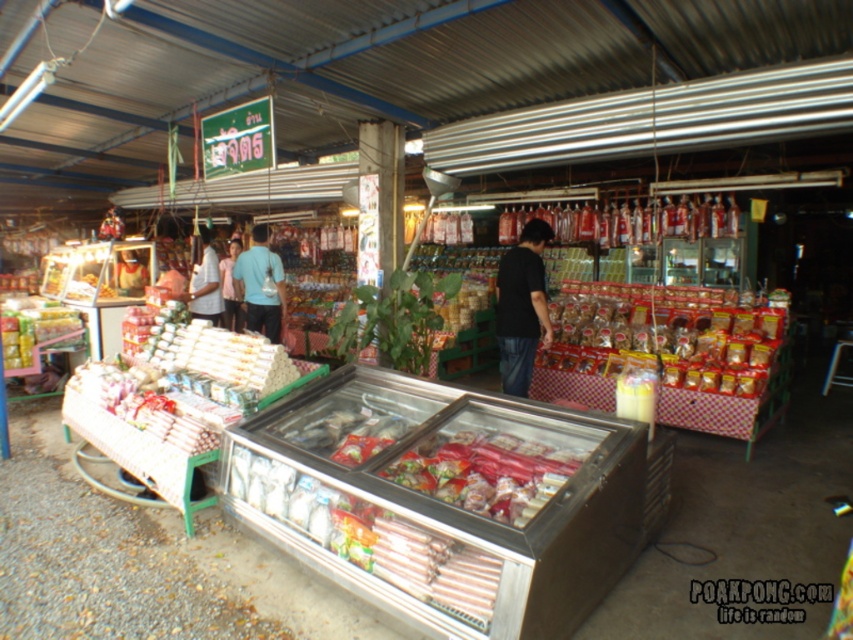
Question: Among these points, which one is farthest from the camera?

Choices:
 (A) (206, 291)
 (B) (541, 291)
 (C) (170, 381)
 (D) (241, 276)

Answer: (D)

Question: Is translucent plastic meat at center below blue cotton shirt at center?

Choices:
 (A) no
 (B) yes

Answer: (B)

Question: In this image, where is matte brown bread at center right located relative to translucent plastic meat at center?

Choices:
 (A) above
 (B) below

Answer: (A)

Question: Among these points, which one is nearest to the camera?

Choices:
 (A) (77, 387)
 (B) (260, 317)

Answer: (A)

Question: Among these objects, which one is farthest from the camera?

Choices:
 (A) translucent plastic meat at center
 (B) black matte shirt at center
 (C) white paper rolls at left

Answer: (B)

Question: Can you confirm if translucent plastic meat at center is positioned above black matte shirt at center?

Choices:
 (A) no
 (B) yes

Answer: (A)